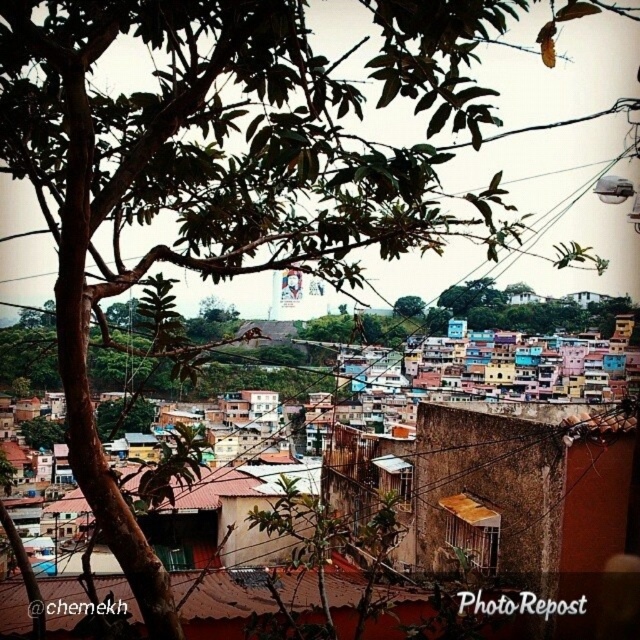
Which is in front, point (416, 541) or point (422, 314)?

Positioned in front is point (416, 541).

Which is above, brown textured wall at center or green leafy tree at center?

green leafy tree at center

Between point (493, 554) and point (394, 307), which one is positioned in front?

Positioned in front is point (493, 554).

What are the coordinates of `brown textured wall at center` in the screenshot? It's located at (508, 481).